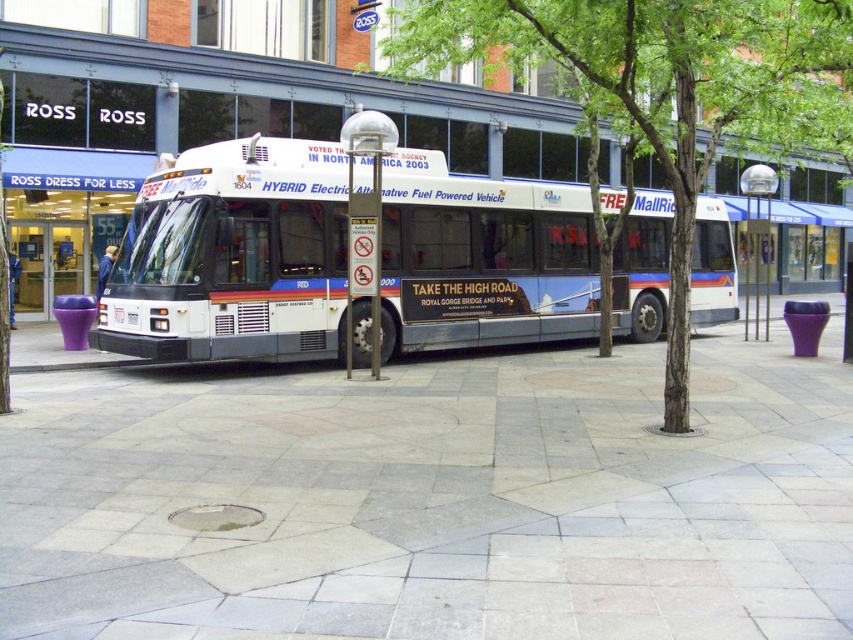
You are a pedestrian standing on the sidewalk and want to take a photo of the Ross Dress for Less store while avoiding the bus in your shot. Since the white matte bus at center and the green leafy tree at center are in the scene, which object should you position yourself closer to in order to frame the store without the bus obstructing the view?

You should position yourself closer to the green leafy tree at center. Since the white matte bus at center is below the green leafy tree at center, moving closer to the tree would allow you to angle your shot above the bus, framing the Ross Dress for Less store without obstruction.

Based on the scene description, which object takes up more area in the image? Please choose between the gray stone pavement at center and the green leafy tree at center.

The green leafy tree at center occupies more space than the gray stone pavement at center according to the description.